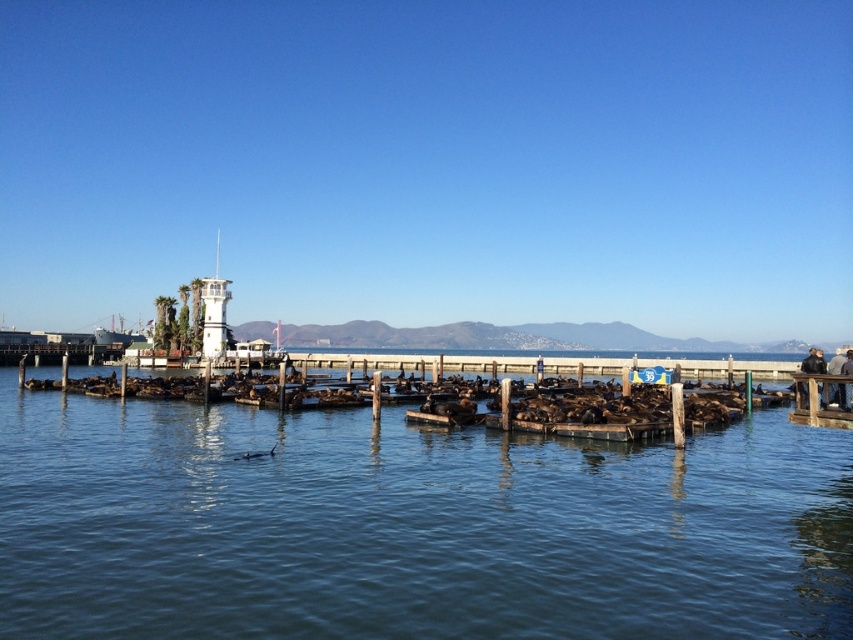
You are a photographer wanting to capture both the white plastic tower at center and the black leather jacket at lower right in the same frame. Based on their positions, which object should you adjust your camera to focus on first to ensure both are in the frame?

The white plastic tower at center is positioned on the left side of black leather jacket at lower right, so you should focus on the black leather jacket at lower right first to ensure both are in the frame.

You are a photographer trying to capture the white plastic tower at center and the black leather jacket at lower right in a single frame. Based on their sizes in the image, which object will appear smaller in the photo?

The white plastic tower at center will appear smaller in the photo because it occupies less space than the black leather jacket at lower right according to the description.